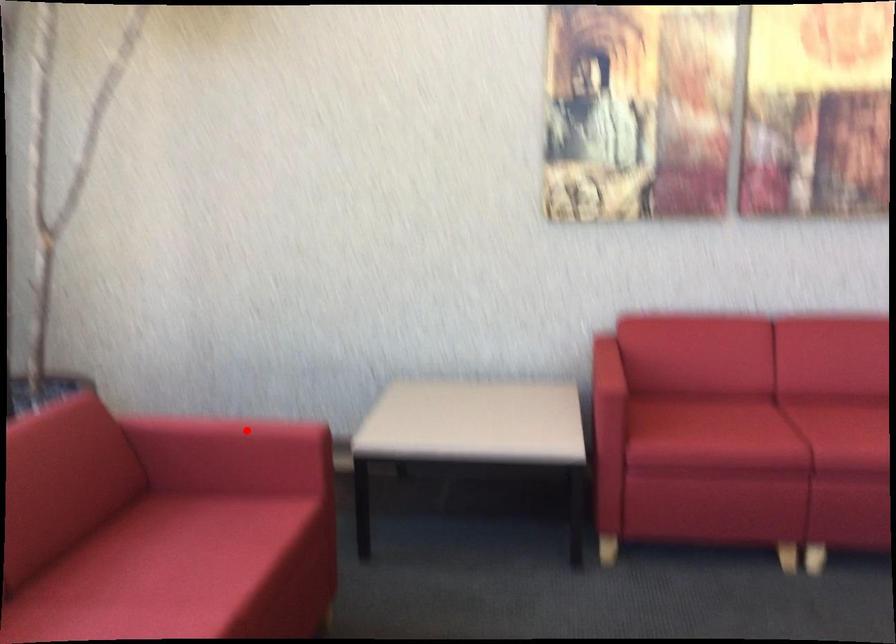
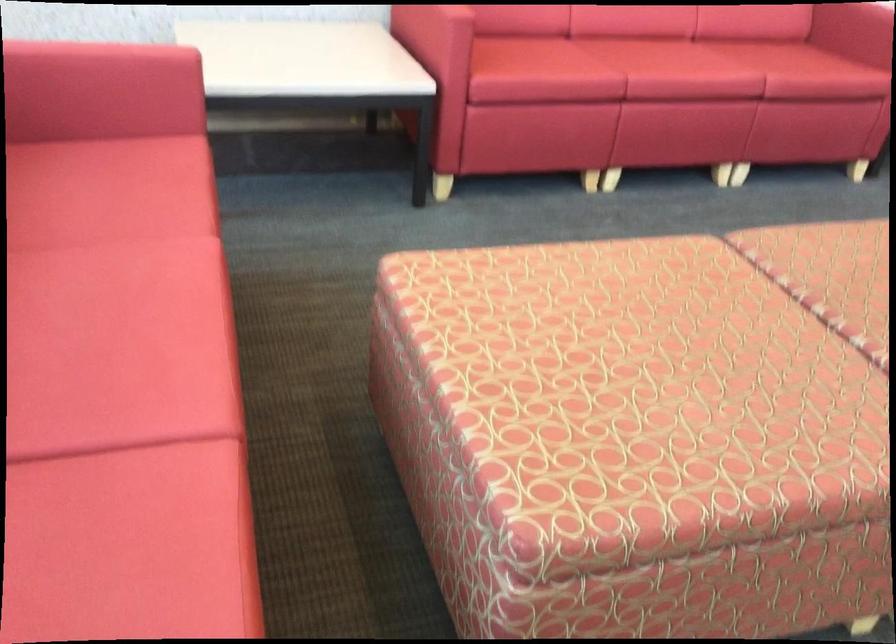
Question: I am providing you with two images of the same scene from different viewpoints. In image1, a red point is highlighted. Considering the same 3D point in image2, which of the following is correct?

Choices:
 (A) It is closer
 (B) It is farther

Answer: (A)